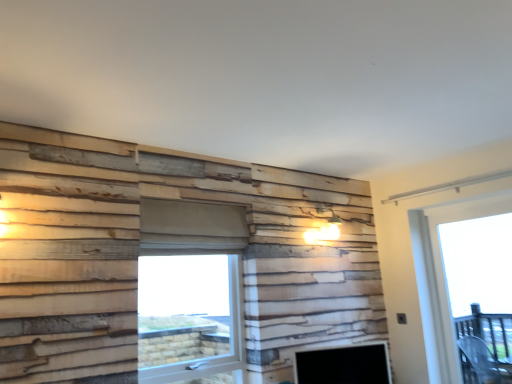
Question: In terms of width, does transparent glass door at right look wider or thinner when compared to matte black fireplace at lower center?

Choices:
 (A) thin
 (B) wide

Answer: (A)

Question: Considering the positions of transparent glass door at right and matte black fireplace at lower center in the image, is transparent glass door at right bigger or smaller than matte black fireplace at lower center?

Choices:
 (A) big
 (B) small

Answer: (A)

Question: Which object is the farthest from the transparent plastic window screen at center?

Choices:
 (A) matte black fireplace at lower center
 (B) transparent glass door at right

Answer: (B)

Question: Which is nearer to the transparent plastic window screen at center?

Choices:
 (A) transparent glass door at right
 (B) matte black fireplace at lower center

Answer: (B)